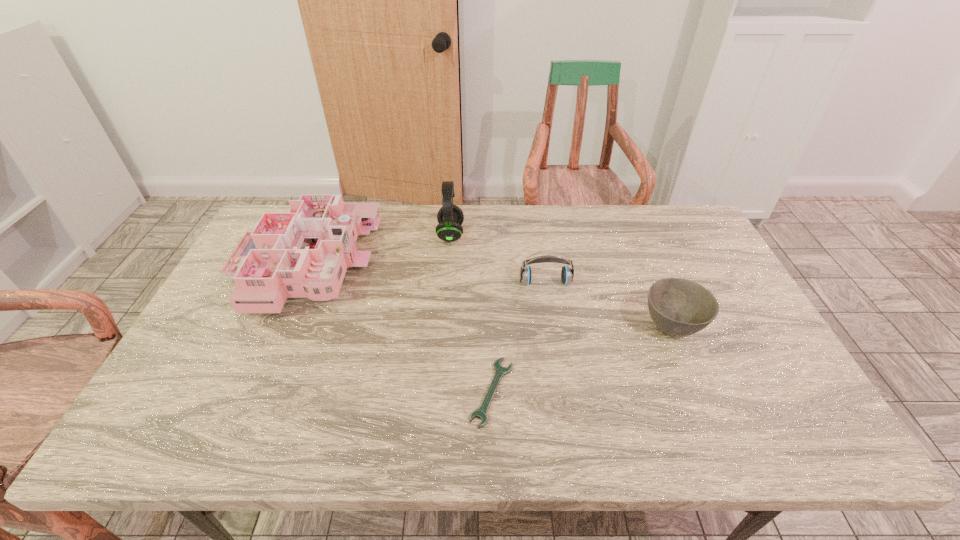
At what (x,y) coordinates should I click in order to perform the action: click on vacant space located 0.320m on the ear cups of the right headset. Please return your answer as a coordinate pair (x, y). This screenshot has height=540, width=960. Looking at the image, I should click on (561, 382).

Locate an element on the screen. Image resolution: width=960 pixels, height=540 pixels. vacant space situated on the back of the bowl is located at coordinates click(x=636, y=240).

You are a GUI agent. You are given a task and a screenshot of the screen. Output one action in this format:
    pyautogui.click(x=<x>, y=<y>)
    Task: Click on the free space located on the back of the nearest object
    
    Given the screenshot: What is the action you would take?
    pyautogui.click(x=490, y=272)

This screenshot has height=540, width=960. What are the coordinates of `headset at the far edge` in the screenshot? It's located at (450, 217).

Find the location of a particular element. dollhouse present at the far edge is located at coordinates (305, 253).

Locate an element on the screen. The height and width of the screenshot is (540, 960). object positioned at the near edge is located at coordinates pos(500,371).

Where is `object located in the left edge section of the desktop`? object located in the left edge section of the desktop is located at coordinates (305, 253).

At what (x,y) coordinates should I click in order to perform the action: click on object that is positioned at the right edge. Please return your answer as a coordinate pair (x, y). The height and width of the screenshot is (540, 960). Looking at the image, I should click on (680, 307).

Where is `object situated at the far left corner`? object situated at the far left corner is located at coordinates (305, 253).

The image size is (960, 540). In the image, there is a desktop. In order to click on vacant space at the far edge in this screenshot , I will do `click(476, 227)`.